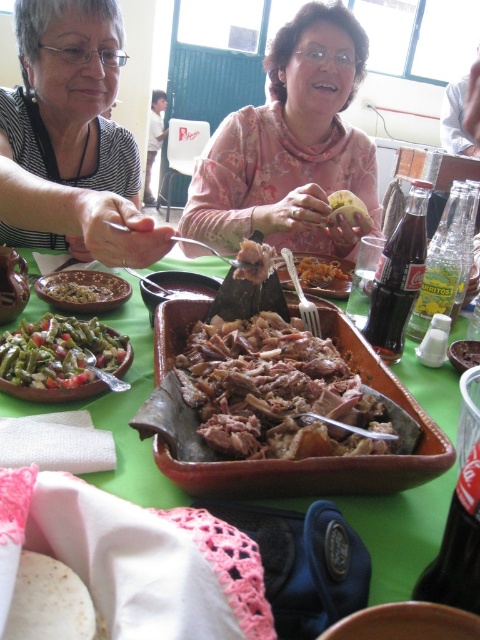
Who is taller, green matte beans at center or dark glass coca-cola at center right?

dark glass coca-cola at center right is taller.

Identify the location of green matte beans at center. (60, 353).

Between point (302, 42) and point (328, 262), which one is positioned behind?

Point (302, 42)

Consider the image. Which is above, floral fabric shirt at center or brown crumbly bread at center?

Positioned higher is floral fabric shirt at center.

Where is `floral fabric shirt at center`? This screenshot has height=640, width=480. floral fabric shirt at center is located at coordinates tap(290, 147).

Between brown meaty at center and green matte beans at center, which one has more height?

brown meaty at center is taller.

Can you confirm if brown meaty at center is thinner than green matte beans at center?

In fact, brown meaty at center might be wider than green matte beans at center.

Where is `brown meaty at center`? This screenshot has width=480, height=640. brown meaty at center is located at coordinates (269, 385).